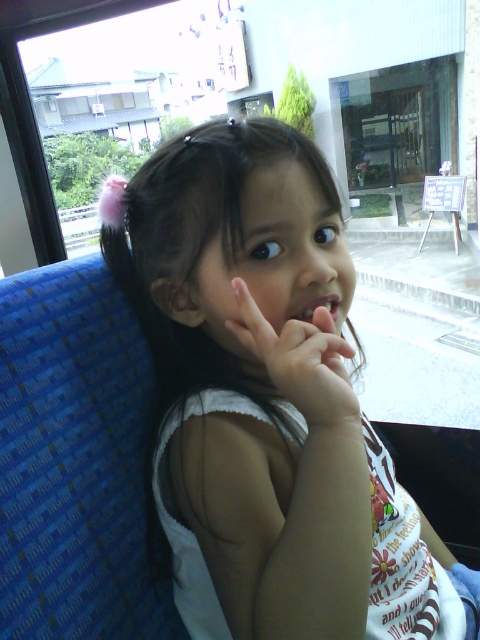
The girl is wearing a white fabric shirt at center and has a white matte hand at center. If she wants to hide her hand from view, which object should she move and in what direction?

The white fabric shirt at center is in front of the white matte hand at center. To hide her hand, she should move the white fabric shirt at center away from the white matte hand at center.

The girl in the image is wearing a white fabric shirt at center and has matte pink lips at center. Which of these is positioned to the left?

The white fabric shirt at center is to the left of the matte pink lips at center.

Based on the scene described, can you determine if the white matte hand at center is wider than the matte pink lips at center?

The white matte hand at center is wider than matte pink lips at center according to the description provided.